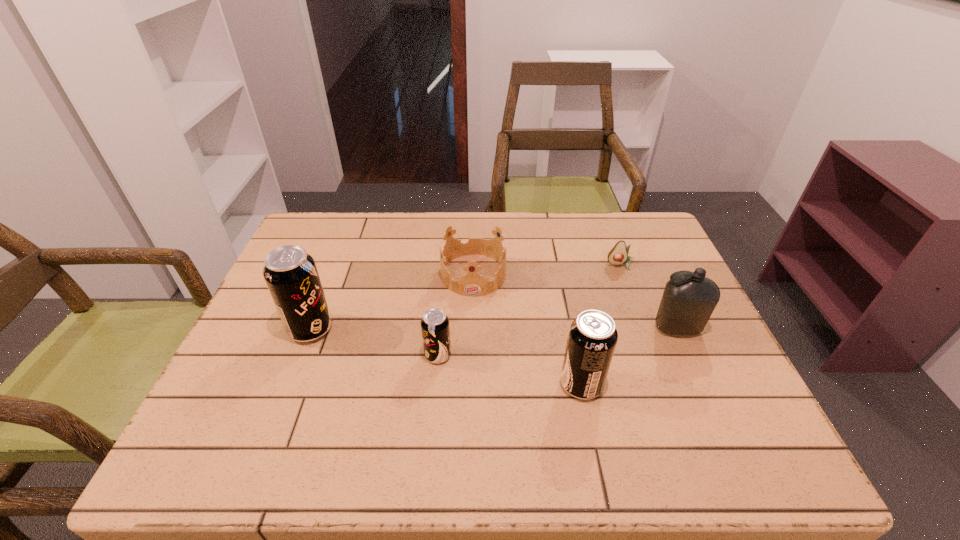
Find the location of a particular element. The image size is (960, 540). vacant space that satisfies the following two spatial constraints: 1. on the seed side of the avocado; 2. on the right side of the bottle is located at coordinates (644, 328).